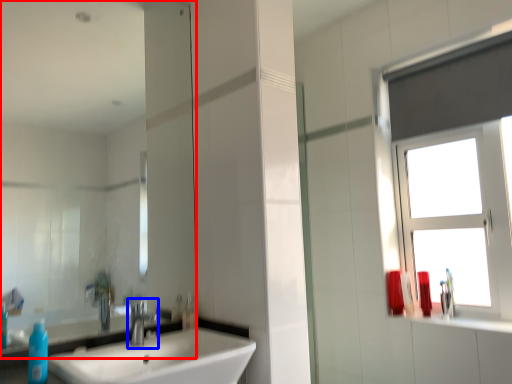
Question: Which point is closer to the camera, mirror (highlighted by a red box) or tap (highlighted by a blue box)?

Choices:
 (A) mirror
 (B) tap

Answer: (A)